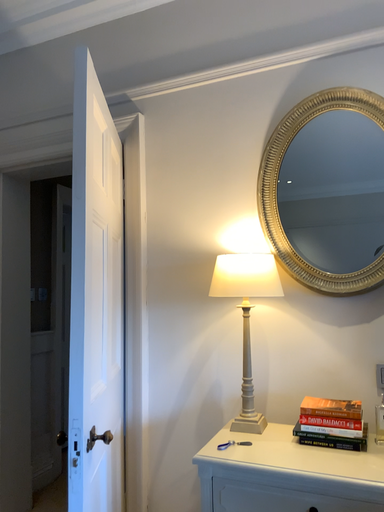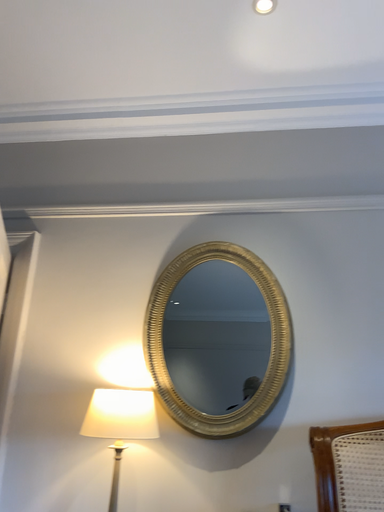
Question: Which way did the camera rotate in the video?

Choices:
 (A) rotated downward
 (B) rotated upward

Answer: (B)